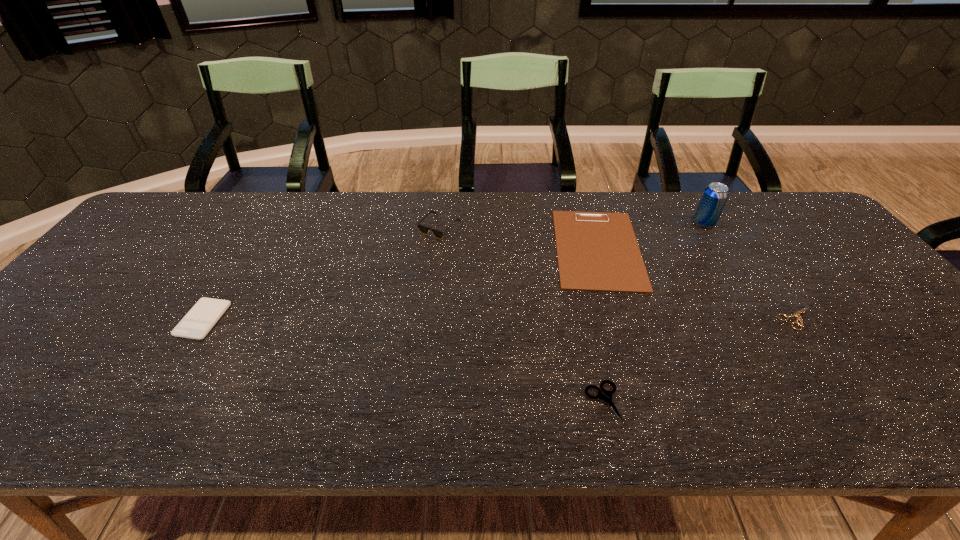
You are a GUI agent. You are given a task and a screenshot of the screen. Output one action in this format:
    pyautogui.click(x=<x>, y=<y>)
    Task: Click on the vacant space located on the lenses of the second object from left to right
    
    Given the screenshot: What is the action you would take?
    pyautogui.click(x=430, y=312)

Where is `free location located 0.210m on the right of the clipboard`? free location located 0.210m on the right of the clipboard is located at coordinates (715, 248).

Where is `vacant space situated on the left of the calculator`? vacant space situated on the left of the calculator is located at coordinates (133, 319).

Where is `free space located on the right of the taller shears`? This screenshot has height=540, width=960. free space located on the right of the taller shears is located at coordinates (756, 403).

Identify the location of free location located on the left of the shortest object. (724, 318).

I want to click on beer can situated at the far edge, so click(714, 197).

Find the location of a particular element. sunglasses present at the far edge is located at coordinates (423, 229).

You are a GUI agent. You are given a task and a screenshot of the screen. Output one action in this format:
    pyautogui.click(x=<x>, y=<y>)
    Task: Click on the clipboard at the far edge
    This screenshot has height=540, width=960.
    Given the screenshot: What is the action you would take?
    pyautogui.click(x=597, y=251)

Locate an element on the screen. Image resolution: width=960 pixels, height=540 pixels. object located in the near edge section of the desktop is located at coordinates pyautogui.click(x=607, y=396).

Locate an element on the screen. This screenshot has height=540, width=960. vacant space at the far edge of the desktop is located at coordinates pyautogui.click(x=388, y=220).